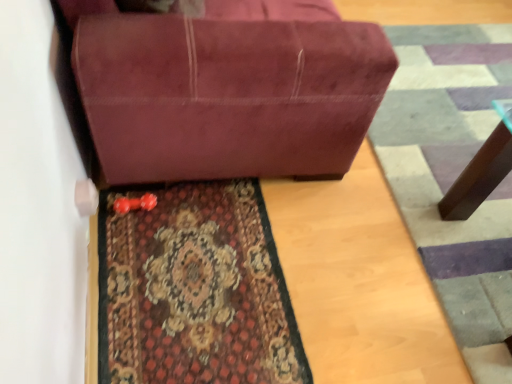
Question: Is suede-like maroon couch at center not near carpeted rug at lower center?

Choices:
 (A) no
 (B) yes

Answer: (A)

Question: From a real-world perspective, is suede-like maroon couch at center below carpeted rug at lower center?

Choices:
 (A) no
 (B) yes

Answer: (A)

Question: From the image's perspective, is suede-like maroon couch at center located beneath carpeted rug at lower center?

Choices:
 (A) yes
 (B) no

Answer: (B)

Question: Considering the relative positions of suede-like maroon couch at center and carpeted rug at lower center in the image provided, is suede-like maroon couch at center to the left of carpeted rug at lower center from the viewer's perspective?

Choices:
 (A) yes
 (B) no

Answer: (B)

Question: Considering the relative positions of suede-like maroon couch at center and carpeted rug at lower center in the image provided, is suede-like maroon couch at center in front of carpeted rug at lower center?

Choices:
 (A) yes
 (B) no

Answer: (A)

Question: Considering the relative sizes of suede-like maroon couch at center and carpeted rug at lower center in the image provided, is suede-like maroon couch at center wider than carpeted rug at lower center?

Choices:
 (A) no
 (B) yes

Answer: (B)

Question: Is suede-like maroon couch at center located within carpeted doormat at lower right?

Choices:
 (A) yes
 (B) no

Answer: (B)

Question: From the image's perspective, is carpeted doormat at lower right under suede-like maroon couch at center?

Choices:
 (A) no
 (B) yes

Answer: (B)

Question: Can you confirm if carpeted doormat at lower right is thinner than suede-like maroon couch at center?

Choices:
 (A) yes
 (B) no

Answer: (B)

Question: From the image's perspective, is carpeted doormat at lower right over suede-like maroon couch at center?

Choices:
 (A) no
 (B) yes

Answer: (A)

Question: Is carpeted doormat at lower right to the left of suede-like maroon couch at center from the viewer's perspective?

Choices:
 (A) yes
 (B) no

Answer: (B)

Question: Is carpeted doormat at lower right directly adjacent to suede-like maroon couch at center?

Choices:
 (A) no
 (B) yes

Answer: (A)

Question: Is carpeted rug at lower center not close to carpeted doormat at lower right?

Choices:
 (A) no
 (B) yes

Answer: (A)